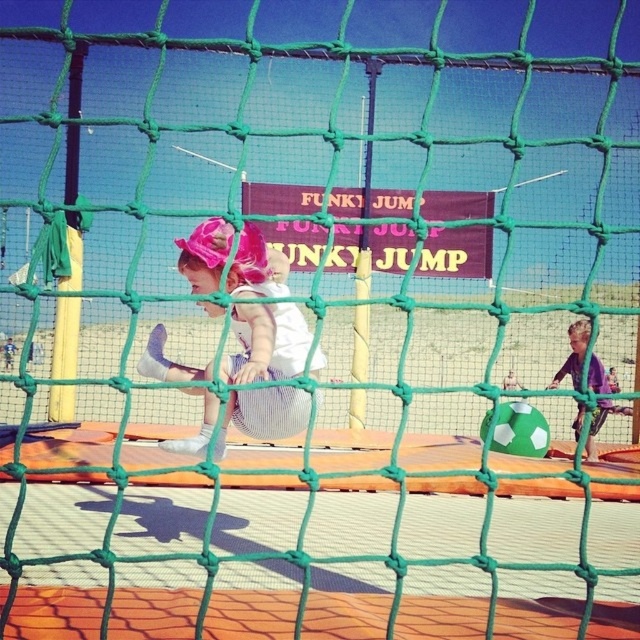
Consider the image. Which is below, pink fabric hat at upper left or purple matte shirt at right?

purple matte shirt at right

Does point (284, 321) come closer to viewer compared to point (595, 388)?

Yes, point (284, 321) is closer to viewer.

Is point (211, 314) more distant than point (579, 369)?

No.

Locate an element on the screen. This screenshot has width=640, height=640. pink fabric hat at upper left is located at coordinates pos(266,342).